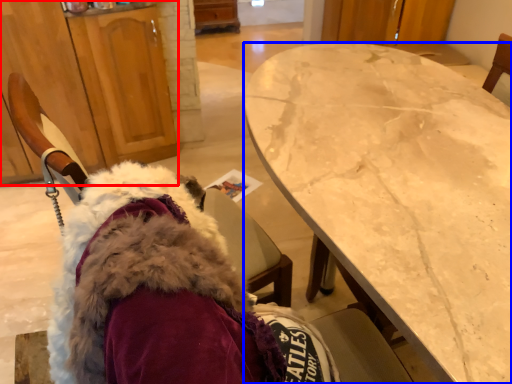
Question: Which of the following is the farthest to the observer, cabinetry (highlighted by a red box) or desk (highlighted by a blue box)?

Choices:
 (A) cabinetry
 (B) desk

Answer: (A)